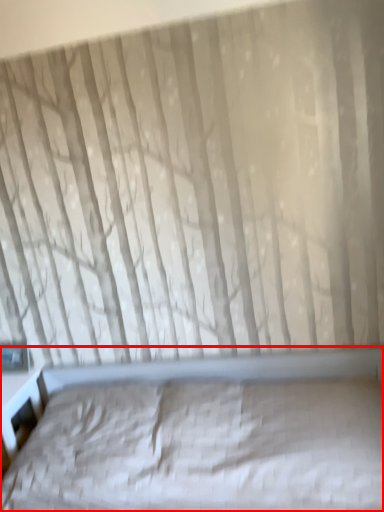
Question: Where is bed (annotated by the red box) located in relation to window in the image?

Choices:
 (A) left
 (B) right

Answer: (B)